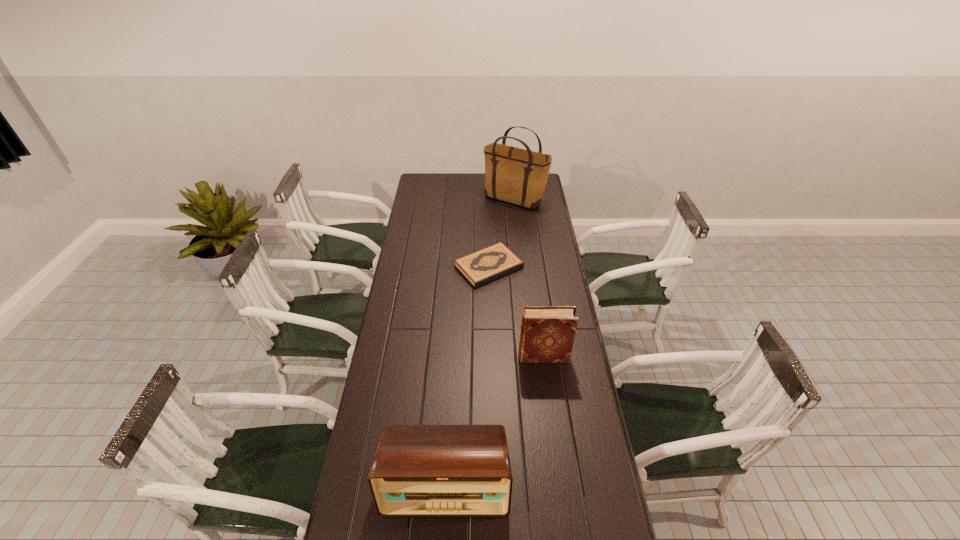
Locate an element on the screen. object that is the closest to the tote bag is located at coordinates (485, 265).

You are a GUI agent. You are given a task and a screenshot of the screen. Output one action in this format:
    pyautogui.click(x=<x>, y=<y>)
    Task: Click on the object that ranks as the second closest to the shorter hardback book
    The image size is (960, 540).
    Given the screenshot: What is the action you would take?
    pyautogui.click(x=547, y=335)